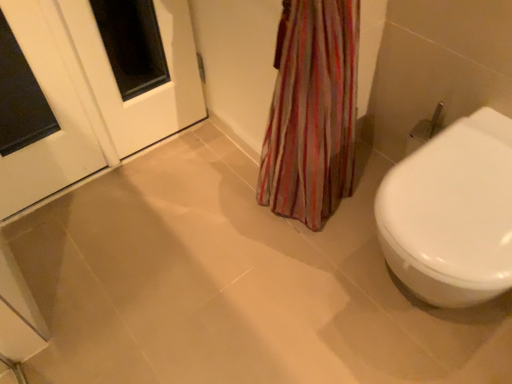
Locate an element on the screen. vacant area on top of white glossy bidet at right (from a real-world perspective) is located at coordinates (460, 188).